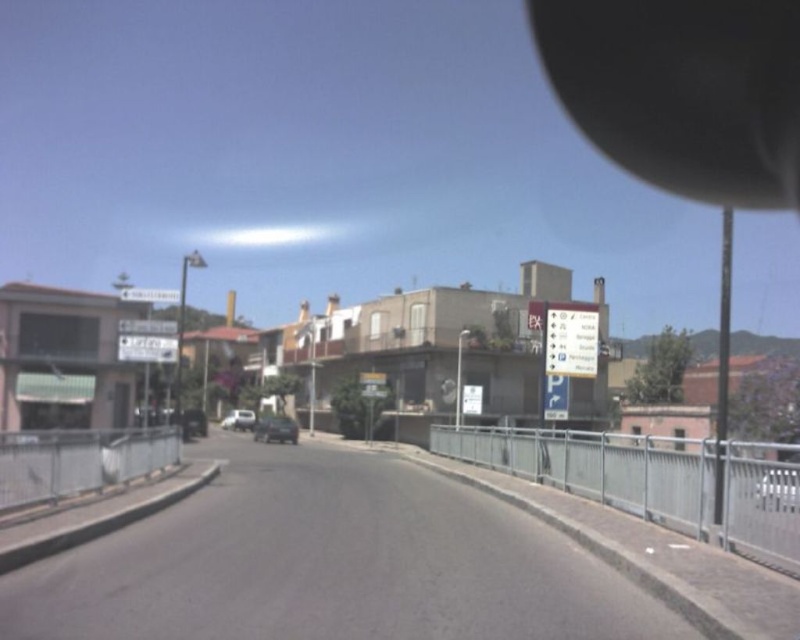
You are a delivery driver trying to park your metallic silver car at center in a space that can only accommodate vehicles narrower than the silver metallic car at center. Will your car fit?

The metallic silver car at center is wider than the silver metallic car at center, so it will not fit in the parking space designed for narrower vehicles.

You are a pedestrian standing on the sidewalk next to the road. You see two cars labeled as metallic silver car at center and silver metallic car at center. Which one is positioned higher in the image?

The metallic silver car at center is positioned higher than the silver metallic car at center in the image.